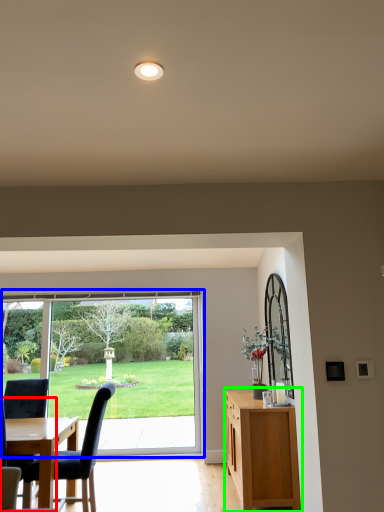
Question: Considering the real-world distances, which object is closest to chair (highlighted by a red box)? window (highlighted by a blue box) or cabinetry (highlighted by a green box).

Choices:
 (A) window
 (B) cabinetry

Answer: (B)